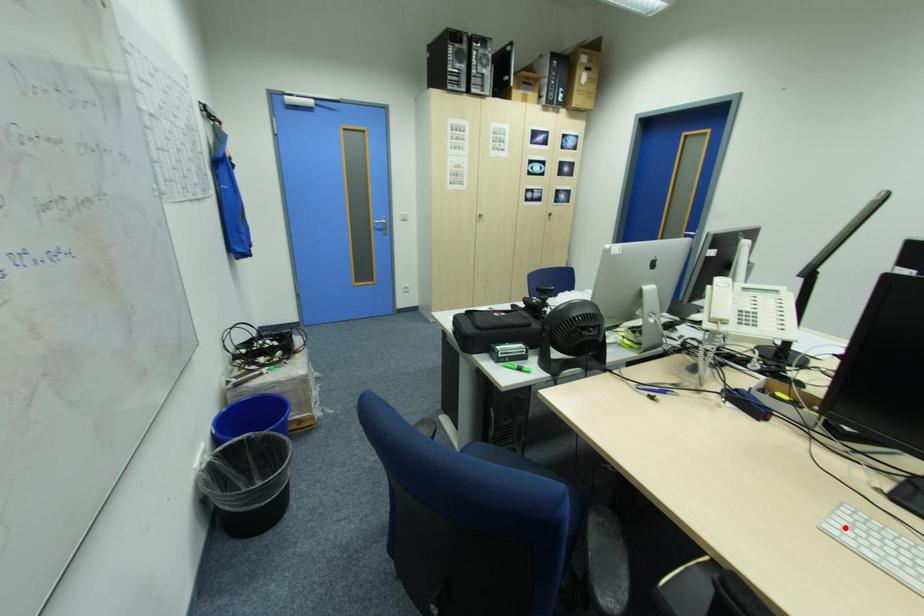
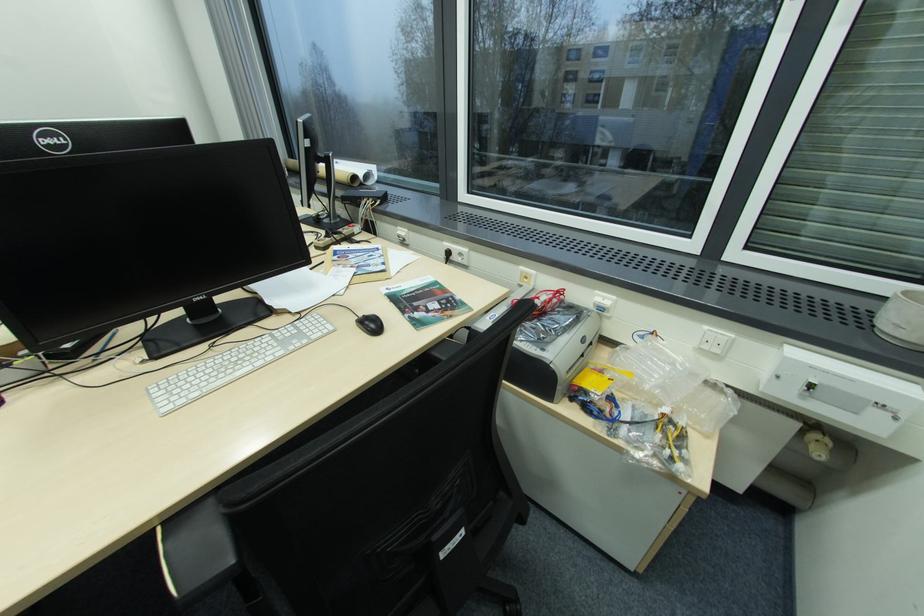
The point at the highlighted location is marked in the first image. Where is the corresponding point in the second image?

(172, 403)